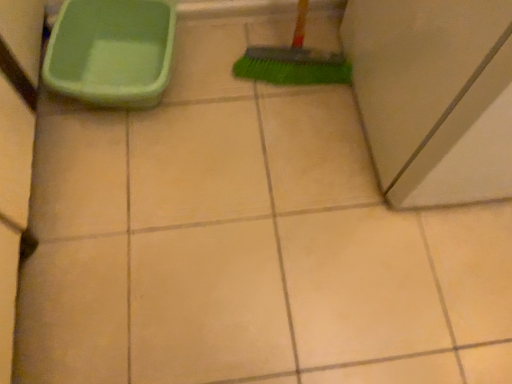
At what (x,y) coordinates should I click in order to perform the action: click on vacant space to the right of green plastic bucket at upper left. Please return your answer as a coordinate pair (x, y). This screenshot has height=384, width=512. Looking at the image, I should click on (228, 95).